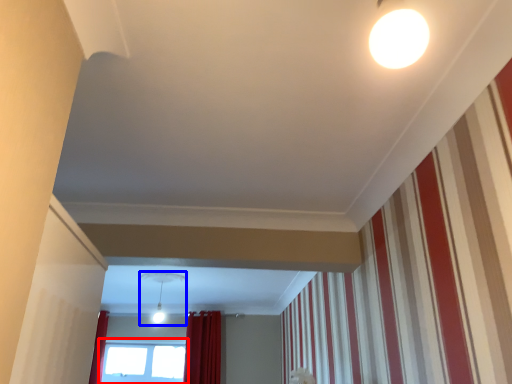
Question: Which object is further to the camera taking this photo, window (highlighted by a red box) or light fixture (highlighted by a blue box)?

Choices:
 (A) window
 (B) light fixture

Answer: (A)